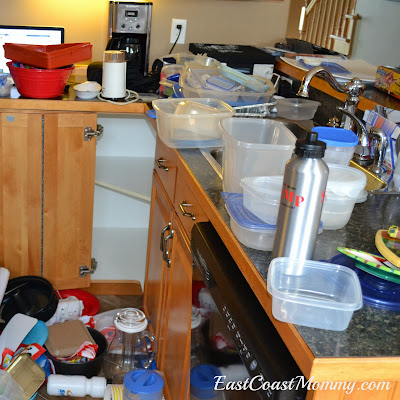
The image size is (400, 400). Find the location of `tub`. tub is located at coordinates coord(345,300).